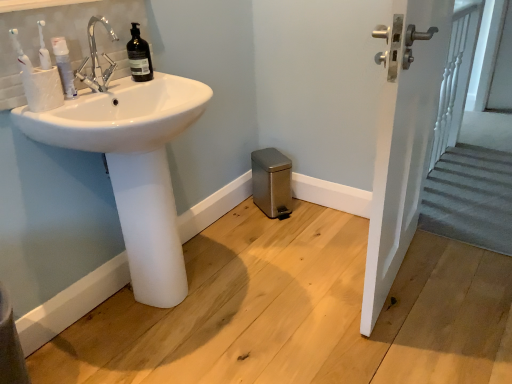
Identify the location of free space in front of white glossy door handle at upper right. Image resolution: width=512 pixels, height=384 pixels. (418, 332).